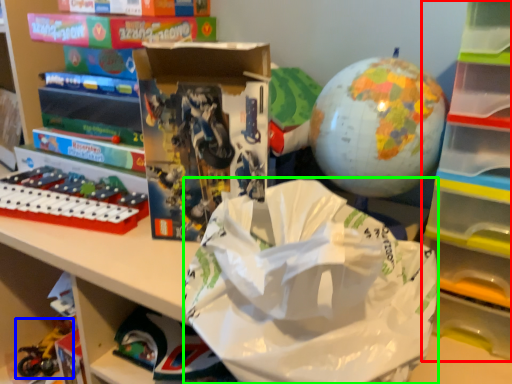
Question: Which is farther away from bookshelf (highlighted by a red box)? toy (highlighted by a blue box) or grocery bag (highlighted by a green box)?

Choices:
 (A) toy
 (B) grocery bag

Answer: (A)